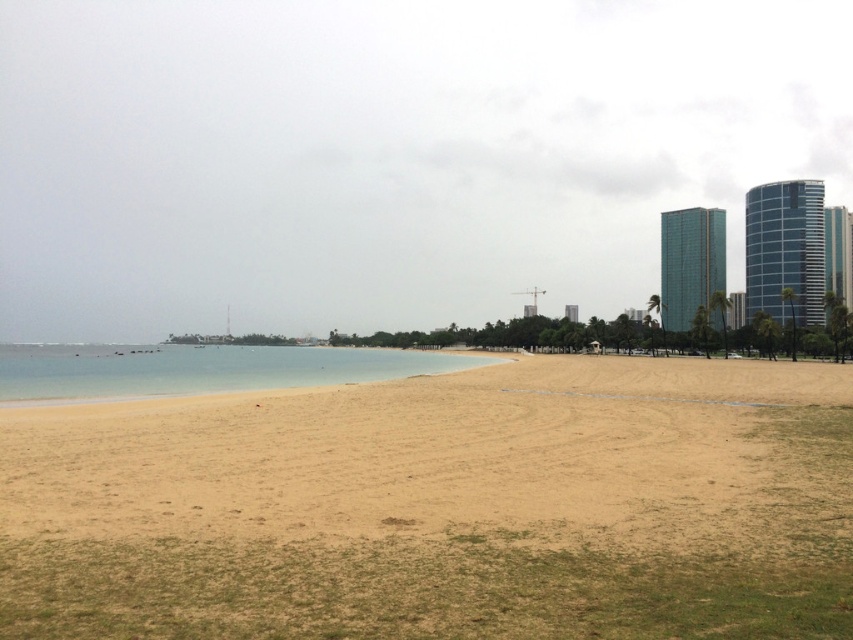
You are standing on the smooth sand beach at center and want to reach the clear water at beach left. Which direction should you walk to get there?

You should walk to the left to reach the clear water at beach left because the smooth sand beach at center is to the right of clear water at beach left.

You are planning to build a sandcastle on the smooth sand beach at center and want to ensure there is enough space. Given that the clear water at beach left is nearby, which area has more space for your sandcastle project?

The clear water at beach left has a larger area compared to the smooth sand beach at center, so there is more space available there for your sandcastle project.

You are standing at the point with coordinates (440,506) on the beach. What type of terrain are you currently standing on?

You are standing on smooth sand beach at center.